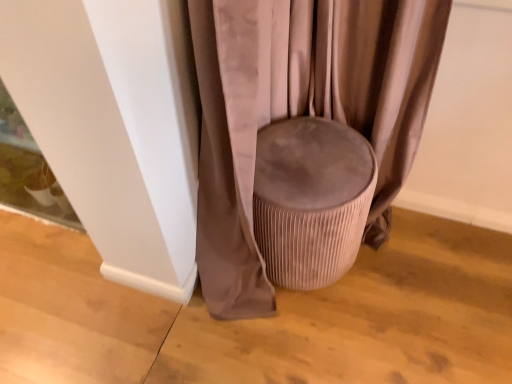
The height and width of the screenshot is (384, 512). I want to click on unoccupied area in front of suede-like beige stool at center, so click(315, 346).